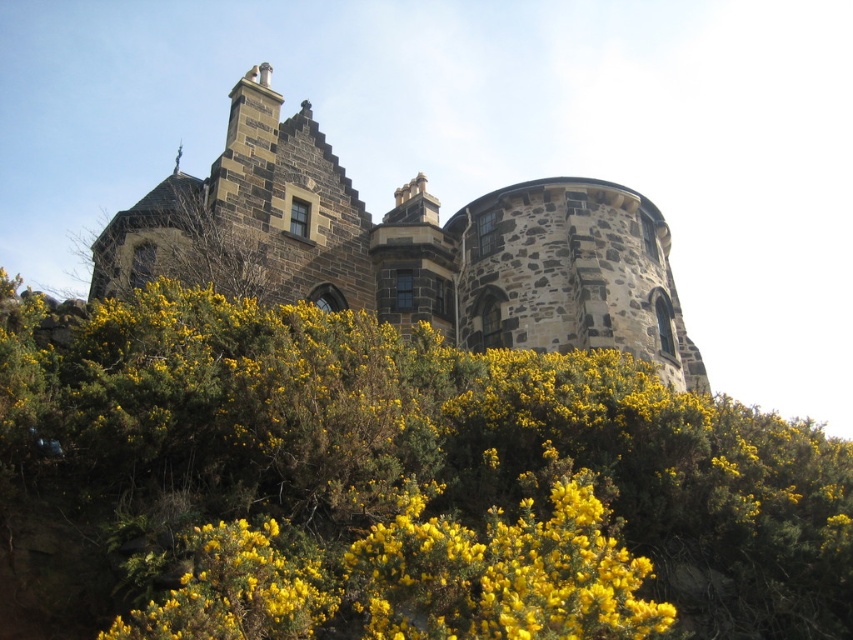
Question: Does yellow-green foliage at center come behind rustic stone castle at center?

Choices:
 (A) yes
 (B) no

Answer: (B)

Question: Is the position of yellow-green foliage at center more distant than that of rustic stone castle at center?

Choices:
 (A) no
 (B) yes

Answer: (A)

Question: From the image, what is the correct spatial relationship of yellow-green foliage at center in relation to rustic stone castle at center?

Choices:
 (A) above
 (B) below

Answer: (B)